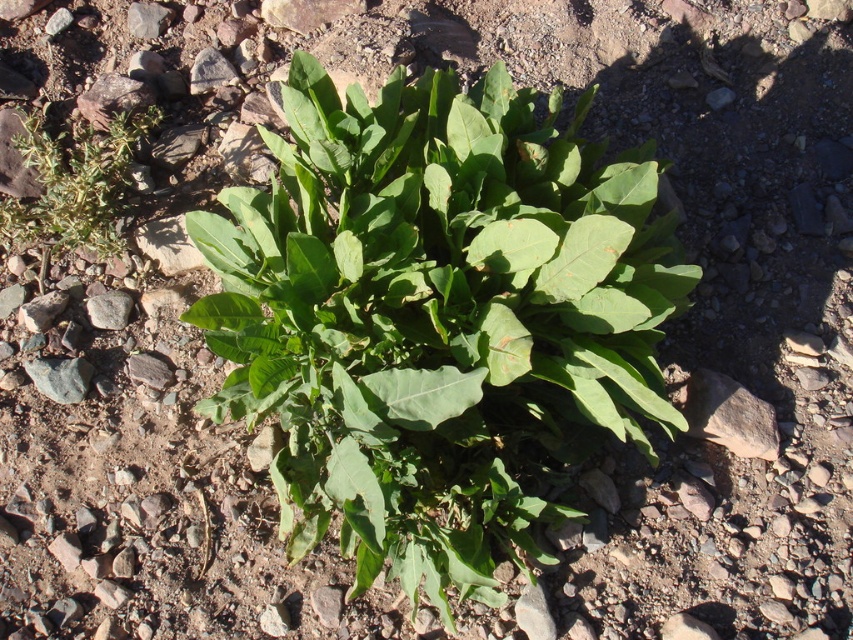
Does green leafy plant at center lie in front of green leafy plant at left?

Yes, it is.

Can you confirm if green leafy plant at center is smaller than green leafy plant at left?

Incorrect, green leafy plant at center is not smaller in size than green leafy plant at left.

Between point (212, 348) and point (90, 214), which one is positioned in front?

Point (212, 348)

Image resolution: width=853 pixels, height=640 pixels. I want to click on green leafy plant at center, so click(434, 317).